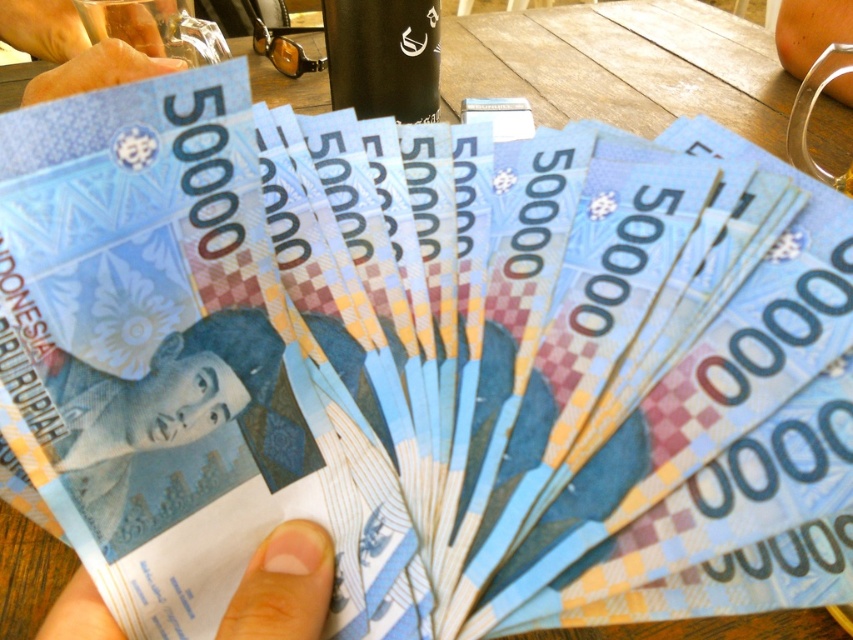
Is white matte paper at lower center to the left of matte blue paper money at upper left from the viewer's perspective?

Incorrect, white matte paper at lower center is not on the left side of matte blue paper money at upper left.

Is white matte paper at lower center bigger than matte blue paper money at upper left?

No, white matte paper at lower center is not bigger than matte blue paper money at upper left.

The image size is (853, 640). In order to click on white matte paper at lower center in this screenshot , I will do `click(283, 586)`.

Can you confirm if white matte paper at lower center is positioned below matte plastic hand at upper left?

Correct, white matte paper at lower center is located below matte plastic hand at upper left.

Between white matte paper at lower center and matte plastic hand at upper left, which one appears on the left side from the viewer's perspective?

Positioned to the left is matte plastic hand at upper left.

Find the location of a particular element. white matte paper at lower center is located at coordinates coord(283,586).

Is matte blue paper money at upper left wider than matte plastic hand at upper left?

Yes, matte blue paper money at upper left is wider than matte plastic hand at upper left.

Consider the image. Between matte blue paper money at upper left and matte plastic hand at upper left, which one has less height?

Standing shorter between the two is matte plastic hand at upper left.

Is point (70, 93) positioned after point (38, 10)?

No, (70, 93) is in front of (38, 10).

Image resolution: width=853 pixels, height=640 pixels. I want to click on matte blue paper money at upper left, so click(x=96, y=70).